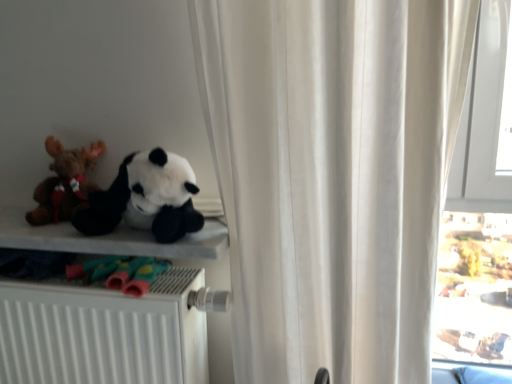
Question: From a real-world perspective, relative to white matte radiator at lower left, is white fabric curtain at upper center vertically above or below?

Choices:
 (A) below
 (B) above

Answer: (B)

Question: Would you say white fabric curtain at upper center is inside or outside white matte radiator at lower left?

Choices:
 (A) inside
 (B) outside

Answer: (B)

Question: Considering the real-world distances, which object is farthest from the white matte radiator at lower left?

Choices:
 (A) soft plush panda at left, which is the first toy from right to left
 (B) white fabric curtain at upper center
 (C) brown plush toy at left, the second toy when ordered from right to left
 (D) soft fabric shelf at left
 (E) transparent glass window at right

Answer: (E)

Question: Estimate the real-world distances between objects in this image. Which object is closer to the transparent glass window at right?

Choices:
 (A) soft plush panda at left, which is the first toy from right to left
 (B) white matte radiator at lower left
 (C) soft fabric shelf at left
 (D) white fabric curtain at upper center
 (E) brown plush toy at left, which appears as the first toy when viewed from the left

Answer: (D)